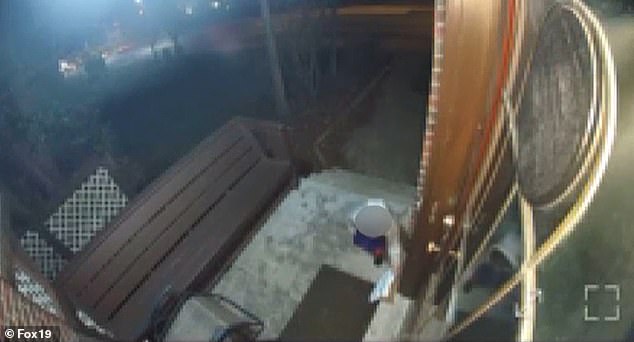
Help me find window door panes, seen from a camera above them in the image by pointing to them. Your answer should be formatted as a list of tuples, i.e. [(x1, y1), (x2, y2), ...], where each tuple contains the x and y coordinates of a point satisfying the conditions above.

[(477, 296), (557, 218), (607, 256), (480, 328), (489, 216), (444, 285), (427, 328)]